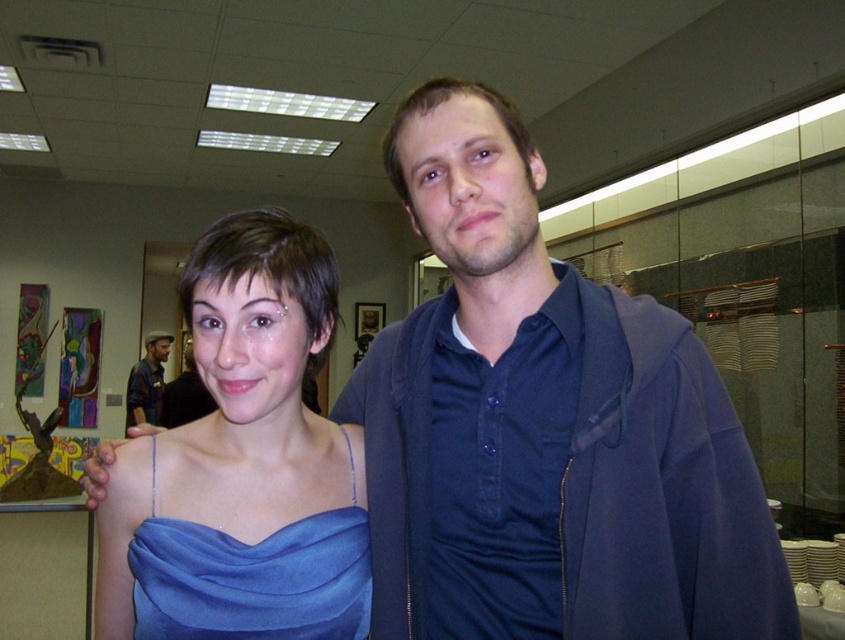
You are at a social event and want to take a photo of the matte blue dress at center. The camera you are using has a focus point set at coordinate point (243, 464). Will this point be effective for capturing the dress in focus?

Yes, the point (243, 464) corresponds to the matte blue dress at center, so setting the focus there will ensure the dress is in focus.

Based on the photo, you are organizing a photo shoot and need to ensure that the matte blue dress at center and the plaid shirt at left are visible in the frame. Based on their widths, which one might require more space to fully capture in the photo?

The plaid shirt at left requires more space because it has a greater width than the matte blue dress at center.